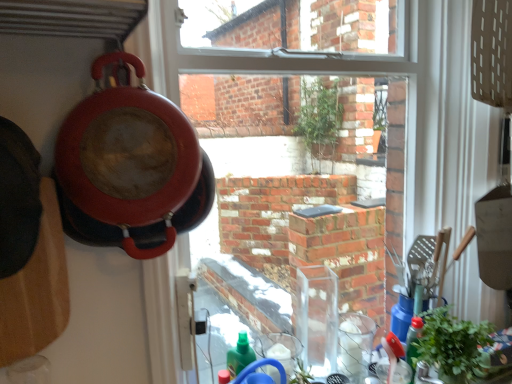
Question: From a real-world perspective, is matte red pizza pan at left above or below green leafy plant at lower right?

Choices:
 (A) above
 (B) below

Answer: (A)

Question: Is matte red pizza pan at left bigger or smaller than green leafy plant at lower right?

Choices:
 (A) big
 (B) small

Answer: (A)

Question: In the image, is matte red pizza pan at left positioned in front of or behind green leafy plant at lower right?

Choices:
 (A) front
 (B) behind

Answer: (A)

Question: Is green leafy plant at lower right inside or outside of matte red pizza pan at left?

Choices:
 (A) outside
 (B) inside

Answer: (A)

Question: Is point (424, 329) closer or farther from the camera than point (72, 147)?

Choices:
 (A) closer
 (B) farther

Answer: (B)

Question: Is green leafy plant at lower right wider or thinner than matte red pizza pan at left?

Choices:
 (A) wide
 (B) thin

Answer: (A)

Question: From the image's perspective, is green leafy plant at lower right positioned above or below matte red pizza pan at left?

Choices:
 (A) above
 (B) below

Answer: (B)